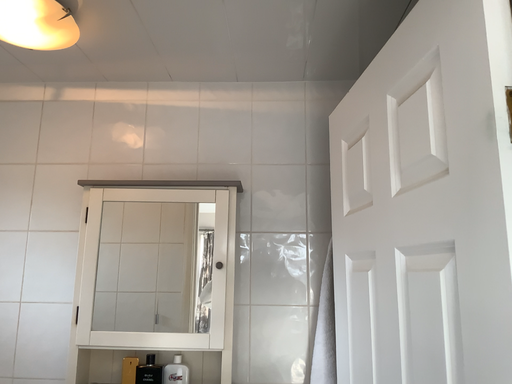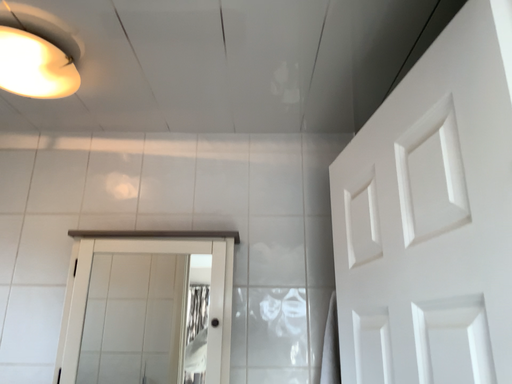
Question: Which way did the camera rotate in the video?

Choices:
 (A) rotated downward
 (B) rotated upward

Answer: (B)